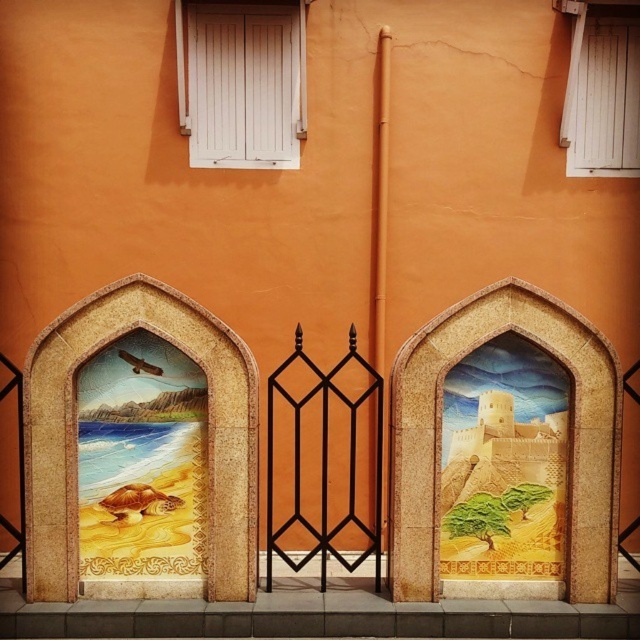
You are a painter who wants to add a new element to the image. The golden sandcastle at right and the white painted wood at upper center are in the scene. Where should you place a small flag so that it is between these two objects?

The small flag should be placed between the golden sandcastle at right and the white painted wood at upper center. Since the golden sandcastle at right is below the white painted wood at upper center, the flag can be positioned vertically between them along the vertical axis.

You are an interior designer planning to place a decorative item that is 1 meter wide between the golden sandcastle at right and the white painted wood at upper center. Based on the scene description, will the space between them accommodate the item?

The golden sandcastle at right is narrower than the white painted wood at upper center. However, the exact distance between them isn not specified in the object descriptions. The question asks about the space between them accommodating a 1m wide item, but the provided information only compares their widths, not the distance between them. Thus, insufficient data to determine.

You are standing in front of the wall with the two arched panels. There is a point at coordinates point (230, 116) that you want to reach with a 20 feet long pole. Can the pole reach that point?

The distance of point (230, 116) from camera is 24.49 feet, so the pole cannot reach it since it is longer than the pole.